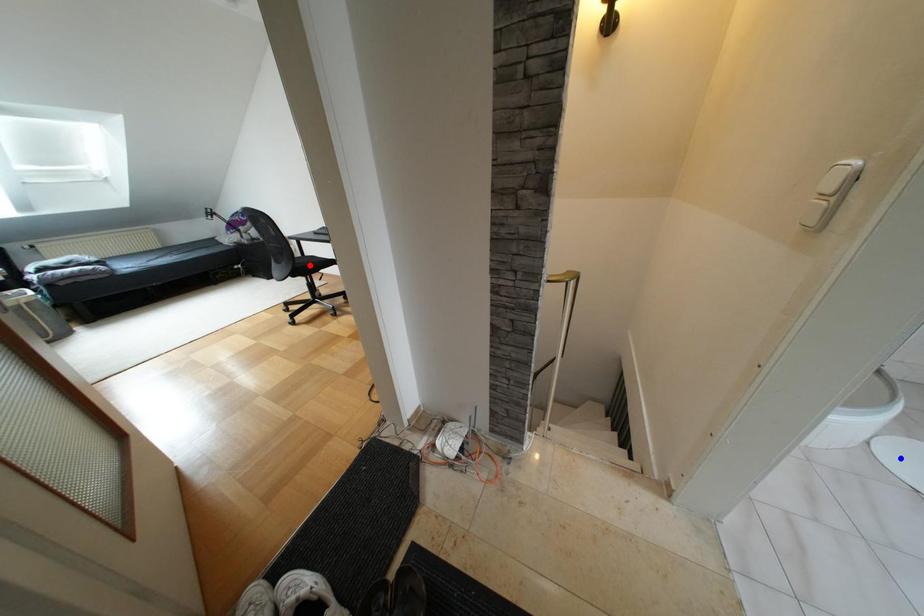
Question: Two points are marked on the image. Which point is closer to the camera?

Choices:
 (A) Blue point is closer.
 (B) Red point is closer.

Answer: (A)